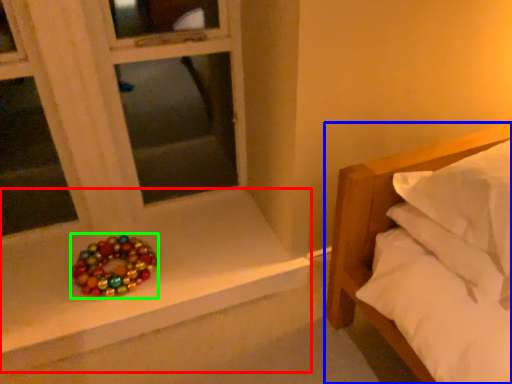
Question: Which object is positioned farthest from window sill (highlighted by a red box)? Select from bed (highlighted by a blue box) and glass bead (highlighted by a green box).

Choices:
 (A) bed
 (B) glass bead

Answer: (A)